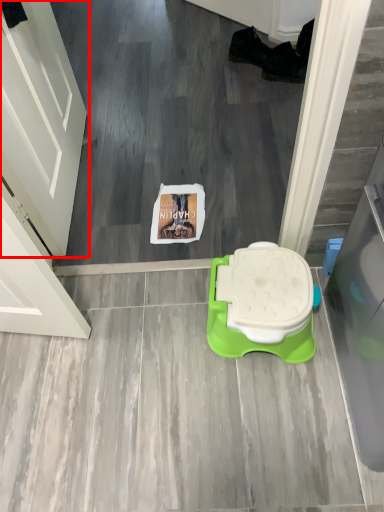
Question: Considering the relative positions of door (annotated by the red box) and toilet in the image provided, where is door (annotated by the red box) located with respect to the staircase?

Choices:
 (A) left
 (B) right

Answer: (A)